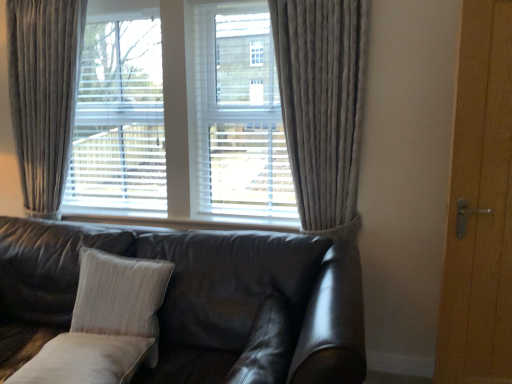
Measure the distance between wooden door at right and camera.

They are 5.68 feet apart.

What do you see at coordinates (44, 95) in the screenshot? I see `velvet gray curtain at left, acting as the 2th curtain starting from the right` at bounding box center [44, 95].

You are a GUI agent. You are given a task and a screenshot of the screen. Output one action in this format:
    pyautogui.click(x=<x>, y=<y>)
    Task: Click on the gray textured curtain at center, which appears as the second curtain when viewed from the left
    The width and height of the screenshot is (512, 384).
    Given the screenshot: What is the action you would take?
    pyautogui.click(x=322, y=106)

Locate an element on the screen. This screenshot has height=384, width=512. silky gray curtains at center is located at coordinates (181, 119).

Locate an element on the screen. The width and height of the screenshot is (512, 384). leather couch at center is located at coordinates (203, 294).

Image resolution: width=512 pixels, height=384 pixels. Describe the element at coordinates (266, 345) in the screenshot. I see `suede-like beige pillow at lower center, the 2th pillow in the left-to-right sequence` at that location.

At what (x,y) coordinates should I click in order to perform the action: click on textured beige pillow at center, placed as the 2th pillow when sorted from front to back. Please return your answer as a coordinate pair (x, y). The height and width of the screenshot is (384, 512). Looking at the image, I should click on (119, 294).

At what (x,y) coordinates should I click in order to perform the action: click on window behind the suede-like beige pillow at lower center, the second pillow from the back. Please return your answer as a coordinate pair (x, y). This screenshot has width=512, height=384. Looking at the image, I should click on (181, 119).

Are suede-like beige pillow at lower center, the second pillow from the back, and silky gray curtains at center located far from each other?

Yes, suede-like beige pillow at lower center, the second pillow from the back, is far from silky gray curtains at center.

Based on the photo, in the image, is suede-like beige pillow at lower center, the second pillow from the back, on the left side or the right side of silky gray curtains at center?

suede-like beige pillow at lower center, the second pillow from the back, is to the right of silky gray curtains at center.

Does suede-like beige pillow at lower center, the second pillow from the back, have a lesser height compared to silky gray curtains at center?

Yes, suede-like beige pillow at lower center, the second pillow from the back, is shorter than silky gray curtains at center.

From a real-world perspective, between wooden door at right and silky gray curtains at center, who is vertically higher?

From a 3D spatial view, silky gray curtains at center is above.

From the picture: Is wooden door at right taller or shorter than silky gray curtains at center?

Clearly, wooden door at right is taller compared to silky gray curtains at center.

In the scene shown: Between wooden door at right and silky gray curtains at center, which one has smaller width?

wooden door at right is thinner.

Considering the relative positions of wooden door at right and silky gray curtains at center in the image provided, is wooden door at right to the left or to the right of silky gray curtains at center?

Clearly, wooden door at right is on the right of silky gray curtains at center in the image.

Based on the photo, considering the relative sizes of leather couch at center and suede-like beige pillow at lower center, marked as the 1th pillow in a right-to-left arrangement, in the image provided, is leather couch at center shorter than suede-like beige pillow at lower center, marked as the 1th pillow in a right-to-left arrangement,?

No, leather couch at center is not shorter than suede-like beige pillow at lower center, marked as the 1th pillow in a right-to-left arrangement.

From a real-world perspective, is leather couch at center below suede-like beige pillow at lower center, the 2th pillow in the left-to-right sequence?

Yes, from a real-world perspective, leather couch at center is beneath suede-like beige pillow at lower center, the 2th pillow in the left-to-right sequence.

What's the angular difference between leather couch at center and suede-like beige pillow at lower center, the second pillow from the back,'s facing directions?

The angular difference between leather couch at center and suede-like beige pillow at lower center, the second pillow from the back, is 90 degrees.

Are leather couch at center and suede-like beige pillow at lower center, marked as the 1th pillow in a right-to-left arrangement, beside each other?

There is a gap between leather couch at center and suede-like beige pillow at lower center, marked as the 1th pillow in a right-to-left arrangement.

Is wooden door at right closer to the viewer compared to suede-like beige pillow at lower center, marked as the 1th pillow in a right-to-left arrangement?

No, the depth of wooden door at right is greater than that of suede-like beige pillow at lower center, marked as the 1th pillow in a right-to-left arrangement.

Is wooden door at right oriented towards suede-like beige pillow at lower center, the 2th pillow in the left-to-right sequence?

No, wooden door at right is not oriented towards suede-like beige pillow at lower center, the 2th pillow in the left-to-right sequence.

Is point (470, 80) closer or farther from the camera than point (265, 311)?

Point (470, 80) is positioned farther from the camera compared to point (265, 311).

What's the angular difference between wooden door at right and suede-like beige pillow at lower center, marked as the 1th pillow in a right-to-left arrangement,'s facing directions?

There is a 94.5-degree angle between the facing directions of wooden door at right and suede-like beige pillow at lower center, marked as the 1th pillow in a right-to-left arrangement.

Does suede-like beige pillow at lower center, the 2th pillow in the left-to-right sequence, appear on the right side of gray textured curtain at center, the first curtain in the right-to-left sequence?

In fact, suede-like beige pillow at lower center, the 2th pillow in the left-to-right sequence, is to the left of gray textured curtain at center, the first curtain in the right-to-left sequence.

From a real-world perspective, is suede-like beige pillow at lower center, marked as the 1th pillow in a right-to-left arrangement, physically located above or below gray textured curtain at center, which appears as the second curtain when viewed from the left?

From a real-world perspective, suede-like beige pillow at lower center, marked as the 1th pillow in a right-to-left arrangement, is physically below gray textured curtain at center, which appears as the second curtain when viewed from the left.

The image size is (512, 384). Identify the location of the 1st pillow to the left when counting from the gray textured curtain at center, the first curtain in the right-to-left sequence. (266, 345).

Is leather couch at center surrounding textured beige pillow at center, placed as the 2th pillow when sorted from front to back?

Yes, leather couch at center contains textured beige pillow at center, placed as the 2th pillow when sorted from front to back.

Does leather couch at center turn towards textured beige pillow at center, marked as the 1th pillow in a left-to-right arrangement?

Yes, leather couch at center is oriented towards textured beige pillow at center, marked as the 1th pillow in a left-to-right arrangement.

Would you consider leather couch at center to be distant from textured beige pillow at center, placed as the 1th pillow when sorted from back to front?

No.

From a real-world perspective, who is located lower, leather couch at center or textured beige pillow at center, placed as the 1th pillow when sorted from back to front?

From a 3D spatial view, leather couch at center is below.

Is suede-like beige pillow at lower center, the 2th pillow in the left-to-right sequence, next to textured beige pillow at center, placed as the 2th pillow when sorted from front to back, and touching it?

No, suede-like beige pillow at lower center, the 2th pillow in the left-to-right sequence, is not with textured beige pillow at center, placed as the 2th pillow when sorted from front to back.

I want to click on pillow on the right of the textured beige pillow at center, placed as the 1th pillow when sorted from back to front, so click(x=266, y=345).

How different are the orientations of suede-like beige pillow at lower center, the 2th pillow in the left-to-right sequence, and textured beige pillow at center, marked as the 1th pillow in a left-to-right arrangement, in degrees?

The facing directions of suede-like beige pillow at lower center, the 2th pillow in the left-to-right sequence, and textured beige pillow at center, marked as the 1th pillow in a left-to-right arrangement, are 90 degrees apart.

From the image's perspective, is suede-like beige pillow at lower center, the second pillow from the back, located above or below textured beige pillow at center, which appears as the 2th pillow when viewed from the right?

Based on their image positions, suede-like beige pillow at lower center, the second pillow from the back, is located beneath textured beige pillow at center, which appears as the 2th pillow when viewed from the right.

In order to click on window on the left of suede-like beige pillow at lower center, the 1th pillow from the front in this screenshot , I will do `click(181, 119)`.

Find the location of a particular element. The width and height of the screenshot is (512, 384). window that is above the wooden door at right (from the image's perspective) is located at coordinates (181, 119).

Based on their spatial positions, is gray textured curtain at center, the first curtain in the right-to-left sequence, or leather couch at center closer to wooden door at right?

Among the two, gray textured curtain at center, the first curtain in the right-to-left sequence, is located nearer to wooden door at right.

Which object lies nearer to the anchor point suede-like beige pillow at lower center, marked as the 1th pillow in a right-to-left arrangement, silky gray curtains at center or wooden door at right?

Among the two, wooden door at right is located nearer to suede-like beige pillow at lower center, marked as the 1th pillow in a right-to-left arrangement.

Estimate the real-world distances between objects in this image. Which object is further from suede-like beige pillow at lower center, the 2th pillow in the left-to-right sequence, leather couch at center or gray textured curtain at center, which appears as the second curtain when viewed from the left?

Based on the image, gray textured curtain at center, which appears as the second curtain when viewed from the left, appears to be further to suede-like beige pillow at lower center, the 2th pillow in the left-to-right sequence.

Estimate the real-world distances between objects in this image. Which object is further from gray textured curtain at center, which appears as the second curtain when viewed from the left, suede-like beige pillow at lower center, the second pillow from the back, or silky gray curtains at center?

Based on the image, suede-like beige pillow at lower center, the second pillow from the back, appears to be further to gray textured curtain at center, which appears as the second curtain when viewed from the left.

Based on their spatial positions, is silky gray curtains at center or gray textured curtain at center, which appears as the second curtain when viewed from the left, closer to wooden door at right?

gray textured curtain at center, which appears as the second curtain when viewed from the left, is closer to wooden door at right.

Based on the photo, estimate the real-world distances between objects in this image. Which object is closer to silky gray curtains at center, suede-like beige pillow at lower center, marked as the 1th pillow in a right-to-left arrangement, or gray textured curtain at center, the first curtain in the right-to-left sequence?

gray textured curtain at center, the first curtain in the right-to-left sequence, is positioned closer to the anchor silky gray curtains at center.

Considering their positions, is wooden door at right positioned further to textured beige pillow at center, marked as the 1th pillow in a left-to-right arrangement, than leather couch at center?

The object further to textured beige pillow at center, marked as the 1th pillow in a left-to-right arrangement, is wooden door at right.

When comparing their distances from silky gray curtains at center, does gray textured curtain at center, which appears as the second curtain when viewed from the left, or leather couch at center seem further?

The object further to silky gray curtains at center is leather couch at center.

Locate an element on the screen. window between textured beige pillow at center, which appears as the 2th pillow when viewed from the right, and wooden door at right from left to right is located at coordinates (181, 119).

I want to click on window between leather couch at center and wooden door at right in the horizontal direction, so click(181, 119).

Image resolution: width=512 pixels, height=384 pixels. I want to click on curtain between leather couch at center and wooden door at right, so click(322, 106).

Find the location of a particular element. This screenshot has height=384, width=512. pillow between silky gray curtains at center and suede-like beige pillow at lower center, the 2th pillow in the left-to-right sequence, in the up-down direction is located at coordinates (119, 294).